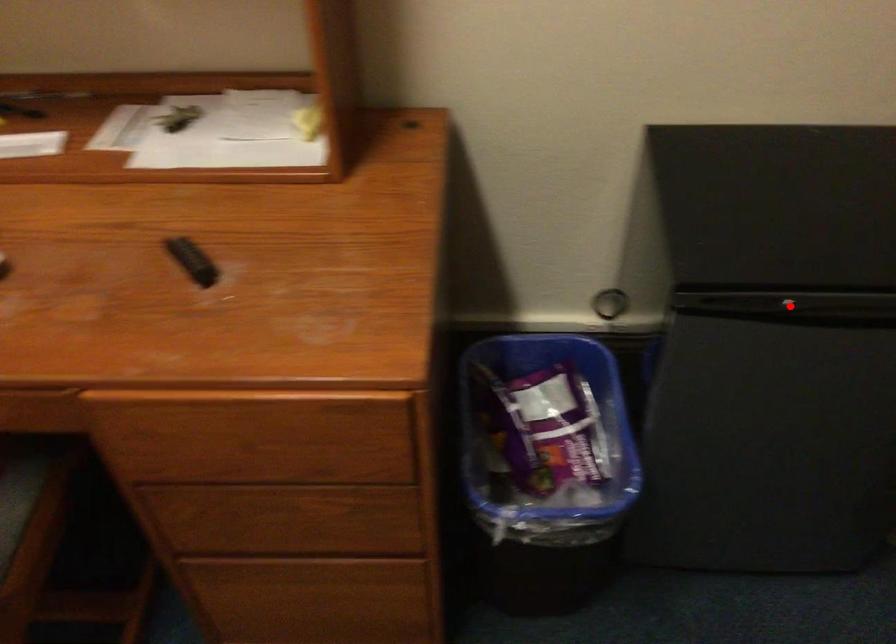
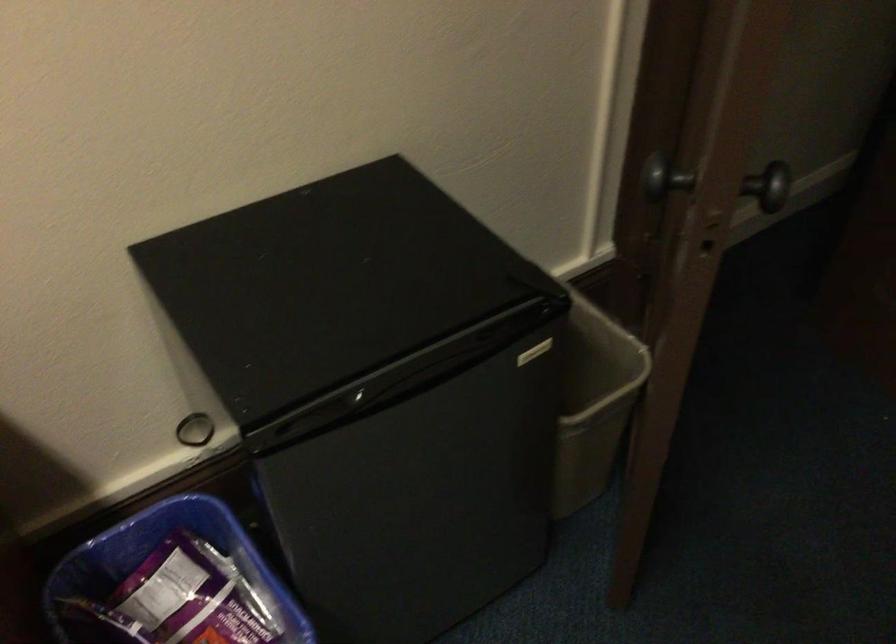
Locate, in the second image, the point that corresponds to the highlighted location in the first image.

(365, 399)